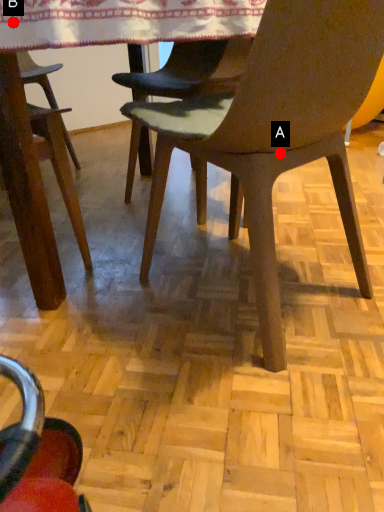
Question: Two points are circled on the image, labeled by A and B beside each circle. Which point appears farthest from the camera in this image?

Choices:
 (A) A is further
 (B) B is further

Answer: (A)